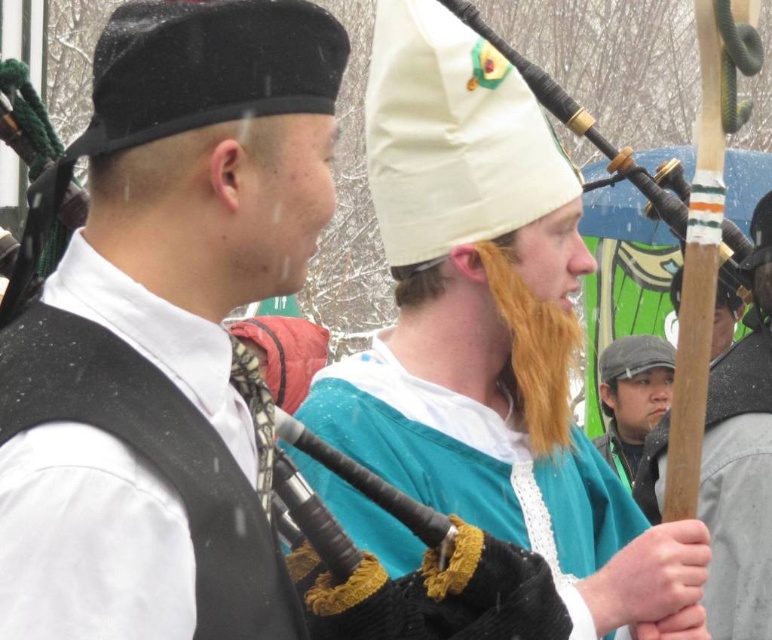
Is point (732, 566) closer to viewer compared to point (664, 392)?

That is True.

Who is more distant from viewer, (x=726, y=632) or (x=613, y=365)?

Point (x=613, y=365)

You are a GUI agent. You are given a task and a screenshot of the screen. Output one action in this format:
    pyautogui.click(x=<x>, y=<y>)
    Task: Click on the wooden stick at center
    This screenshot has width=772, height=640.
    Given the screenshot: What is the action you would take?
    pyautogui.click(x=740, y=461)

Where is `wooden stick at center`? The height and width of the screenshot is (640, 772). wooden stick at center is located at coordinates (740, 461).

Who is higher up, white cloth hat at center or wooden bagpipes at center?

wooden bagpipes at center is higher up.

Which is behind, point (388, 356) or point (676, 198)?

Point (676, 198)

This screenshot has height=640, width=772. I want to click on white cloth hat at center, so click(491, 333).

Is wooden stick at center closer to camera compared to wooden bagpipes at center?

No, wooden stick at center is further to the viewer.

Between point (720, 470) and point (500, 51), which one is positioned in front?

Point (720, 470) is in front.

Identify the location of wooden stick at center. This screenshot has height=640, width=772. (740, 461).